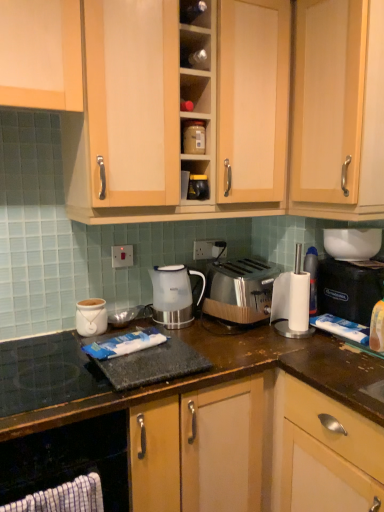
Question: Is white plastic electric outlet at center positioned far away from light wood cabinet at upper right, the second cabinetry when ordered from top to bottom?

Choices:
 (A) no
 (B) yes

Answer: (A)

Question: Can you confirm if white plastic electric outlet at center is thinner than light wood cabinet at upper right, positioned as the 2th cabinetry in bottom-to-top order?

Choices:
 (A) no
 (B) yes

Answer: (B)

Question: Can you confirm if white plastic electric outlet at center is wider than light wood cabinet at upper right, positioned as the 2th cabinetry in bottom-to-top order?

Choices:
 (A) no
 (B) yes

Answer: (A)

Question: From the image's perspective, is white plastic electric outlet at center located beneath light wood cabinet at upper right, positioned as the 2th cabinetry in bottom-to-top order?

Choices:
 (A) no
 (B) yes

Answer: (B)

Question: Is white plastic electric outlet at center facing away from light wood cabinet at upper right, the second cabinetry when ordered from top to bottom?

Choices:
 (A) yes
 (B) no

Answer: (B)

Question: Considering the relative sizes of white plastic electric outlet at center and light wood cabinet at upper right, the second cabinetry when ordered from top to bottom, in the image provided, is white plastic electric outlet at center shorter than light wood cabinet at upper right, the second cabinetry when ordered from top to bottom,?

Choices:
 (A) yes
 (B) no

Answer: (A)

Question: Considering the relative positions of black glass gas stove at lower left and white glossy electric kettle at center in the image provided, is black glass gas stove at lower left to the left of white glossy electric kettle at center from the viewer's perspective?

Choices:
 (A) no
 (B) yes

Answer: (B)

Question: Is black glass gas stove at lower left turned away from white glossy electric kettle at center?

Choices:
 (A) no
 (B) yes

Answer: (A)

Question: From the image's perspective, would you say black glass gas stove at lower left is shown under white glossy electric kettle at center?

Choices:
 (A) yes
 (B) no

Answer: (A)

Question: Does black glass gas stove at lower left have a greater width compared to white glossy electric kettle at center?

Choices:
 (A) no
 (B) yes

Answer: (B)

Question: Considering the relative positions of black glass gas stove at lower left and white glossy electric kettle at center in the image provided, is black glass gas stove at lower left in front of white glossy electric kettle at center?

Choices:
 (A) no
 (B) yes

Answer: (B)

Question: Is black glass gas stove at lower left further to the viewer compared to white glossy electric kettle at center?

Choices:
 (A) no
 (B) yes

Answer: (A)

Question: Is white plastic electric outlet at center inside black glass gas stove at lower left?

Choices:
 (A) yes
 (B) no

Answer: (B)